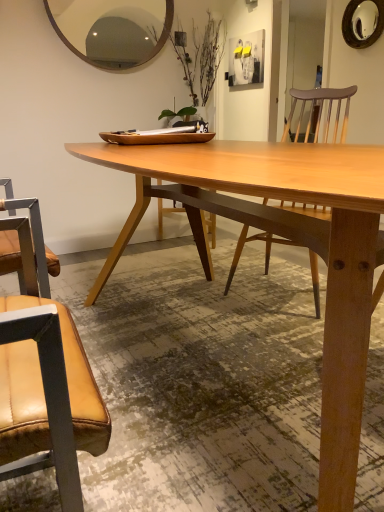
Question: Is wooden mirror at upper right, the 2th mirror viewed from the front, facing away from leather at left?

Choices:
 (A) no
 (B) yes

Answer: (A)

Question: From a real-world perspective, is wooden mirror at upper right, which appears as the 1th mirror when viewed from the right, below leather at left?

Choices:
 (A) yes
 (B) no

Answer: (B)

Question: Does wooden mirror at upper right, which appears as the 1th mirror when viewed from the right, have a smaller size compared to leather at left?

Choices:
 (A) yes
 (B) no

Answer: (A)

Question: Is wooden mirror at upper right, which appears as the 1th mirror when viewed from the right, aimed at leather at left?

Choices:
 (A) yes
 (B) no

Answer: (B)

Question: Considering the relative positions of wooden mirror at upper right, which appears as the first mirror when viewed from the top, and leather at left in the image provided, is wooden mirror at upper right, which appears as the first mirror when viewed from the top, to the right of leather at left from the viewer's perspective?

Choices:
 (A) no
 (B) yes

Answer: (B)

Question: From the image's perspective, is wooden mirror at upper right, positioned as the 2th mirror in bottom-to-top order, above leather at left?

Choices:
 (A) yes
 (B) no

Answer: (A)

Question: Does matte white picture frame at upper center have a lesser height compared to wooden mirror at upper right, which appears as the first mirror when viewed from the top?

Choices:
 (A) no
 (B) yes

Answer: (A)

Question: Is matte white picture frame at upper center thinner than wooden mirror at upper right, which ranks as the 1th mirror in back-to-front order?

Choices:
 (A) no
 (B) yes

Answer: (B)

Question: Are matte white picture frame at upper center and wooden mirror at upper right, positioned as the 2th mirror in bottom-to-top order, far apart?

Choices:
 (A) no
 (B) yes

Answer: (B)

Question: Considering the relative sizes of matte white picture frame at upper center and wooden mirror at upper right, which appears as the 1th mirror when viewed from the right, in the image provided, is matte white picture frame at upper center taller than wooden mirror at upper right, which appears as the 1th mirror when viewed from the right,?

Choices:
 (A) no
 (B) yes

Answer: (B)

Question: From a real-world perspective, is matte white picture frame at upper center beneath wooden mirror at upper right, which appears as the first mirror when viewed from the top?

Choices:
 (A) no
 (B) yes

Answer: (B)

Question: Is matte white picture frame at upper center in front of wooden mirror at upper right, which appears as the 1th mirror when viewed from the right?

Choices:
 (A) no
 (B) yes

Answer: (A)

Question: Can you confirm if leather at left is taller than natural wood table at center?

Choices:
 (A) yes
 (B) no

Answer: (A)